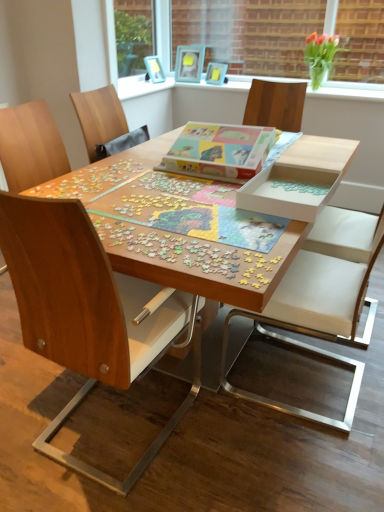
Question: Which direction should I rotate to face multicolored cardboard jigsaw puzzle at center, the 1th jigsaw puzzle in the top-to-bottom sequence, — up or down?

Choices:
 (A) up
 (B) down

Answer: (A)

Question: From the image's perspective, is wooden puzzle at center over wooden chair at left, the second chair from the right?

Choices:
 (A) no
 (B) yes

Answer: (B)

Question: From a real-world perspective, is wooden puzzle at center physically above wooden chair at left, the second chair from the right?

Choices:
 (A) yes
 (B) no

Answer: (B)

Question: Is wooden puzzle at center far from wooden chair at left, positioned as the first chair in left-to-right order?

Choices:
 (A) no
 (B) yes

Answer: (A)

Question: Is wooden puzzle at center turned away from wooden chair at left, positioned as the first chair in left-to-right order?

Choices:
 (A) no
 (B) yes

Answer: (A)

Question: Is wooden chair at left, the second chair from the right, located within wooden puzzle at center?

Choices:
 (A) no
 (B) yes

Answer: (B)

Question: Is wooden puzzle at center not within wooden chair at left, the second chair from the right?

Choices:
 (A) no
 (B) yes

Answer: (B)

Question: Considering the relative sizes of green glass vase at upper right and matte blue picture frame at upper center, the third picture frame viewed from the right, in the image provided, is green glass vase at upper right taller than matte blue picture frame at upper center, the third picture frame viewed from the right,?

Choices:
 (A) no
 (B) yes

Answer: (B)

Question: Is green glass vase at upper right completely or partially outside of matte blue picture frame at upper center, the third picture frame viewed from the right?

Choices:
 (A) no
 (B) yes

Answer: (B)

Question: From a real-world perspective, is green glass vase at upper right physically below matte blue picture frame at upper center, which is the first picture frame from left to right?

Choices:
 (A) no
 (B) yes

Answer: (A)

Question: Does green glass vase at upper right have a lesser width compared to matte blue picture frame at upper center, which is the first picture frame from left to right?

Choices:
 (A) yes
 (B) no

Answer: (B)

Question: Is green glass vase at upper right not near matte blue picture frame at upper center, the third picture frame viewed from the right?

Choices:
 (A) no
 (B) yes

Answer: (B)

Question: Does green glass vase at upper right come in front of matte blue picture frame at upper center, the third picture frame viewed from the right?

Choices:
 (A) yes
 (B) no

Answer: (A)

Question: Is wooden photo frame at upper center, the second picture frame viewed from the right, next to white leather chair at center, which is the 2th chair in left-to-right order?

Choices:
 (A) yes
 (B) no

Answer: (B)